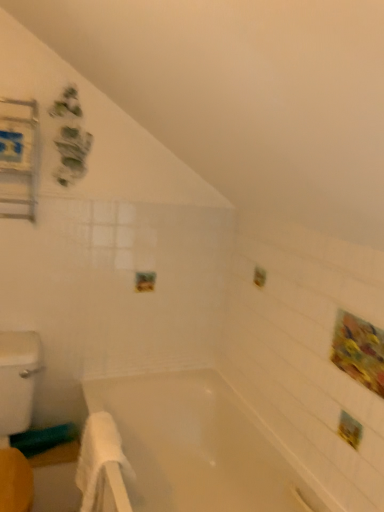
Question: From a real-world perspective, is white soft towel at lower left on top of white glossy bathtub at center?

Choices:
 (A) yes
 (B) no

Answer: (A)

Question: Can you confirm if white soft towel at lower left is shorter than white glossy bathtub at center?

Choices:
 (A) yes
 (B) no

Answer: (A)

Question: From a real-world perspective, is white soft towel at lower left positioned under white glossy bathtub at center based on gravity?

Choices:
 (A) yes
 (B) no

Answer: (B)

Question: Can you confirm if white soft towel at lower left is thinner than white glossy bathtub at center?

Choices:
 (A) yes
 (B) no

Answer: (A)

Question: Considering the relative positions of white soft towel at lower left and white glossy bathtub at center in the image provided, is white soft towel at lower left to the left of white glossy bathtub at center from the viewer's perspective?

Choices:
 (A) no
 (B) yes

Answer: (B)

Question: From the image's perspective, would you say white soft towel at lower left is shown under white glossy bathtub at center?

Choices:
 (A) yes
 (B) no

Answer: (B)

Question: Does white glossy bathtub at center have a lesser height compared to white soft towel at lower left?

Choices:
 (A) no
 (B) yes

Answer: (A)

Question: Does white glossy bathtub at center contain white soft towel at lower left?

Choices:
 (A) no
 (B) yes

Answer: (B)

Question: Does white glossy bathtub at center have a smaller size compared to white soft towel at lower left?

Choices:
 (A) no
 (B) yes

Answer: (A)

Question: Is white glossy bathtub at center oriented towards white soft towel at lower left?

Choices:
 (A) no
 (B) yes

Answer: (B)

Question: Is white glossy bathtub at center to the left of white soft towel at lower left from the viewer's perspective?

Choices:
 (A) no
 (B) yes

Answer: (A)

Question: Is white glossy bathtub at center bigger than white soft towel at lower left?

Choices:
 (A) no
 (B) yes

Answer: (B)

Question: Can you confirm if white soft towel at lower left is wider than metallic silver medicine cabinet at upper left?

Choices:
 (A) no
 (B) yes

Answer: (B)